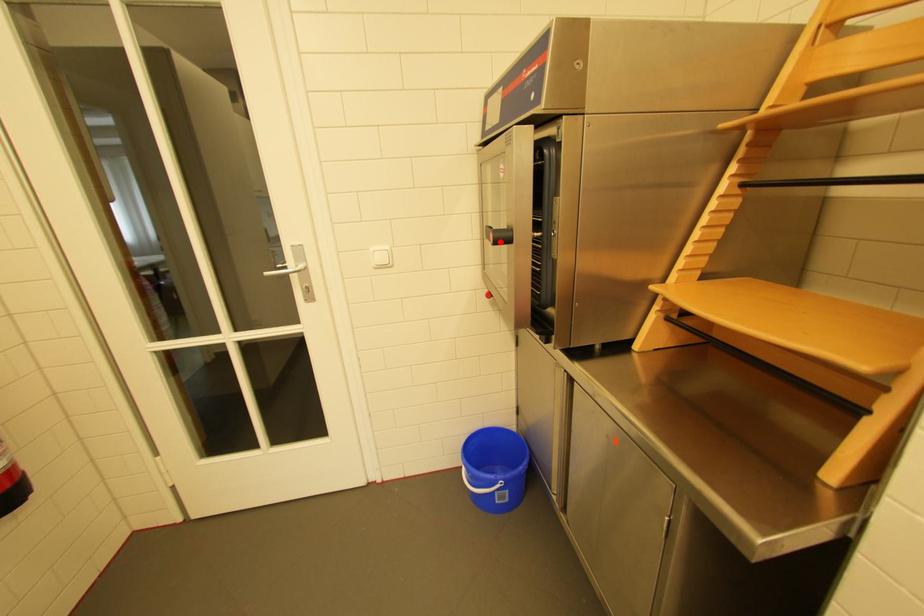
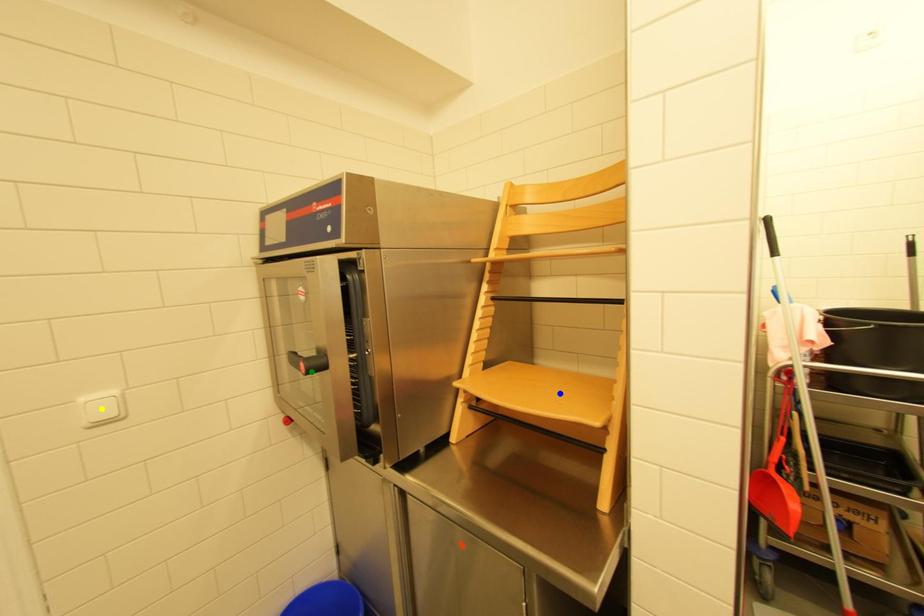
Question: I am providing you with two images of the same scene from different viewpoints. A red point is marked on the first image. You are given multiple points on the second image. In image 2, which mark is for the same physical point as the one in image 1?

Choices:
 (A) green point
 (B) yellow point
 (C) blue point

Answer: (A)